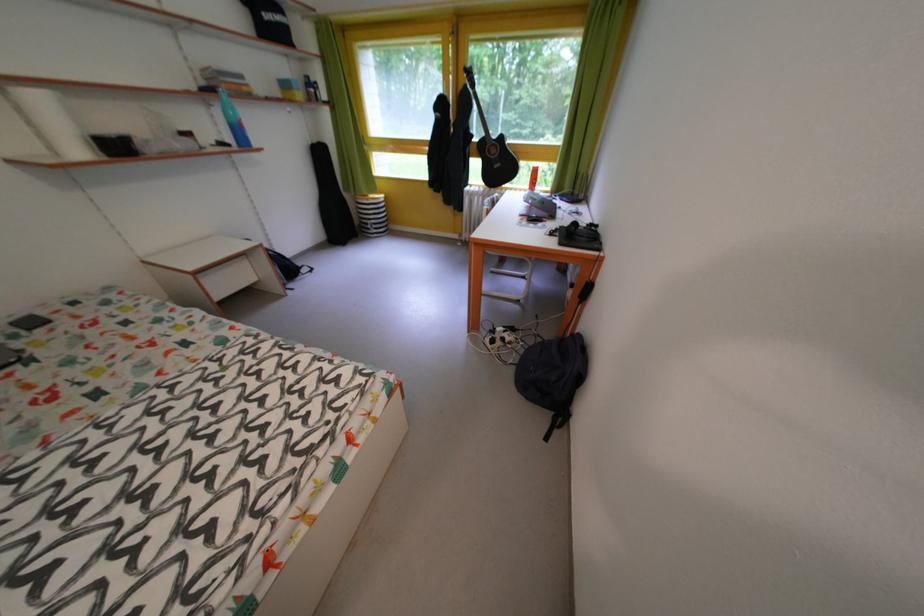
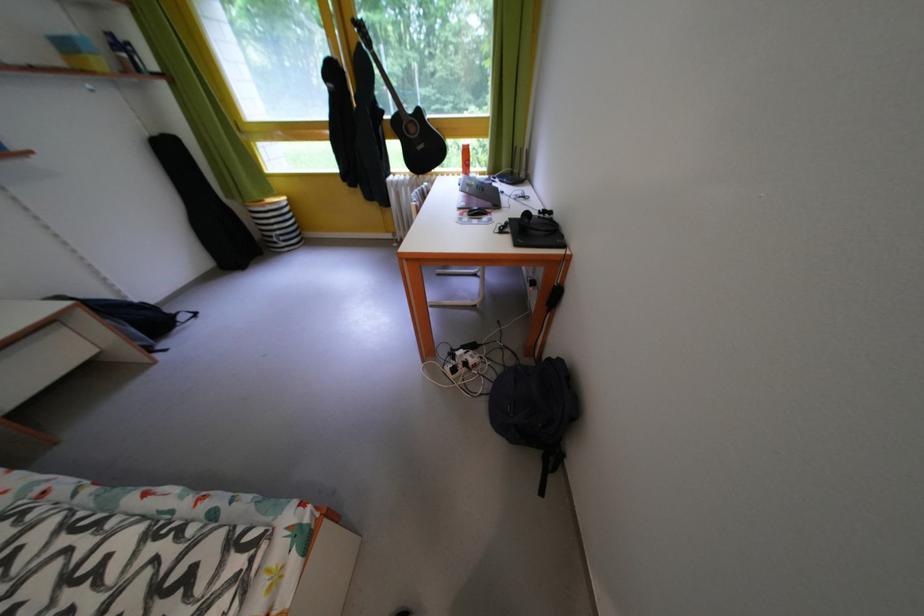
Locate, in the second image, the point that corresponds to point (249, 331) in the first image.

(23, 485)